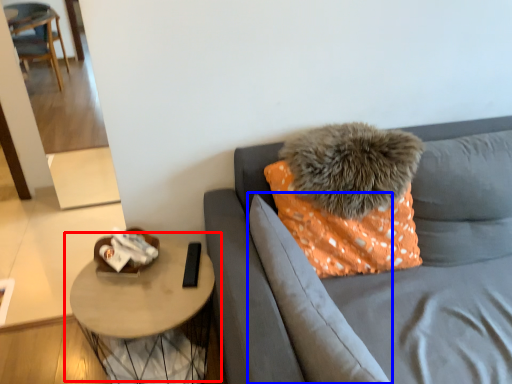
Question: Which object is closer to the camera taking this photo, table (highlighted by a red box) or pillow (highlighted by a blue box)?

Choices:
 (A) table
 (B) pillow

Answer: (B)